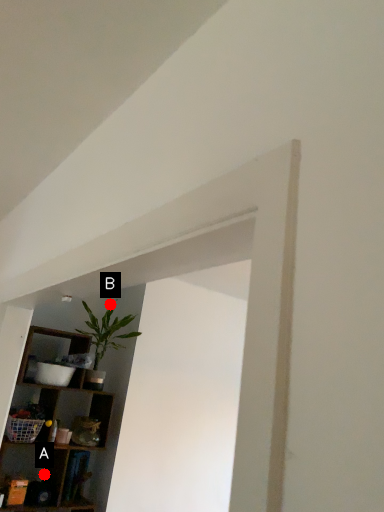
Question: Two points are circled on the image, labeled by A and B beside each circle. Which point is farther from the camera taking this photo?

Choices:
 (A) A is further
 (B) B is further

Answer: (B)